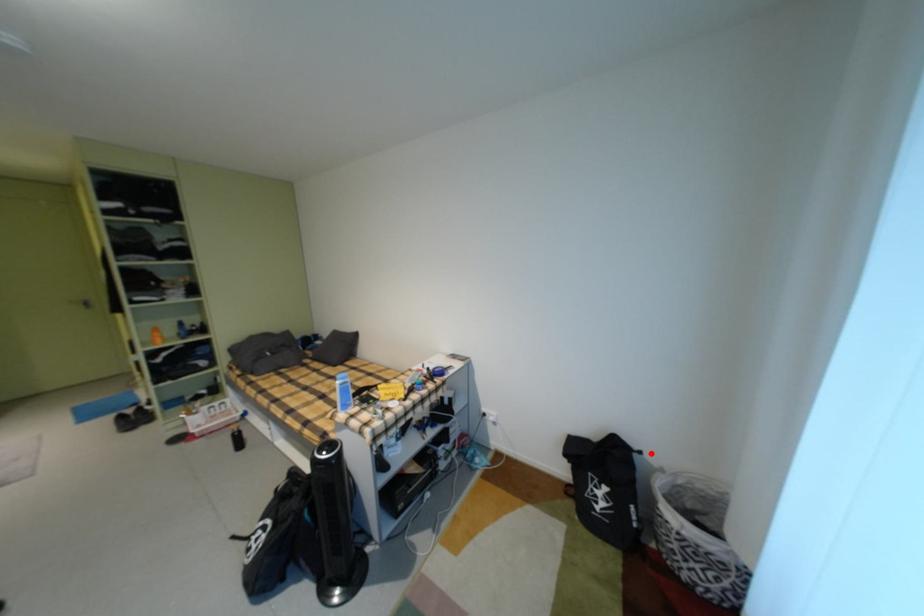
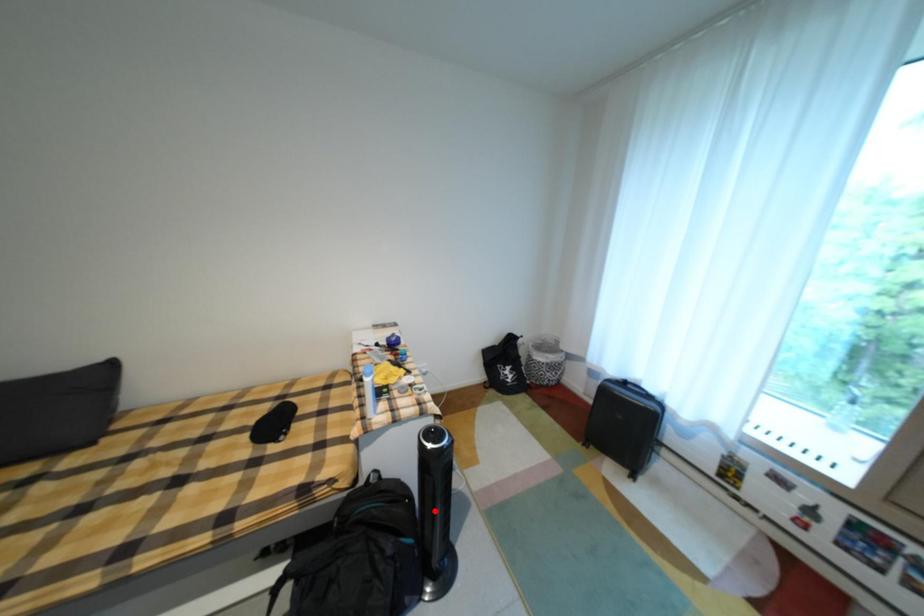
I am providing you with two images of the same scene from different viewpoints. A red point is marked on the first image and another point is marked on the second image. Is the red point in image1 aligned with the point shown in image2?

No